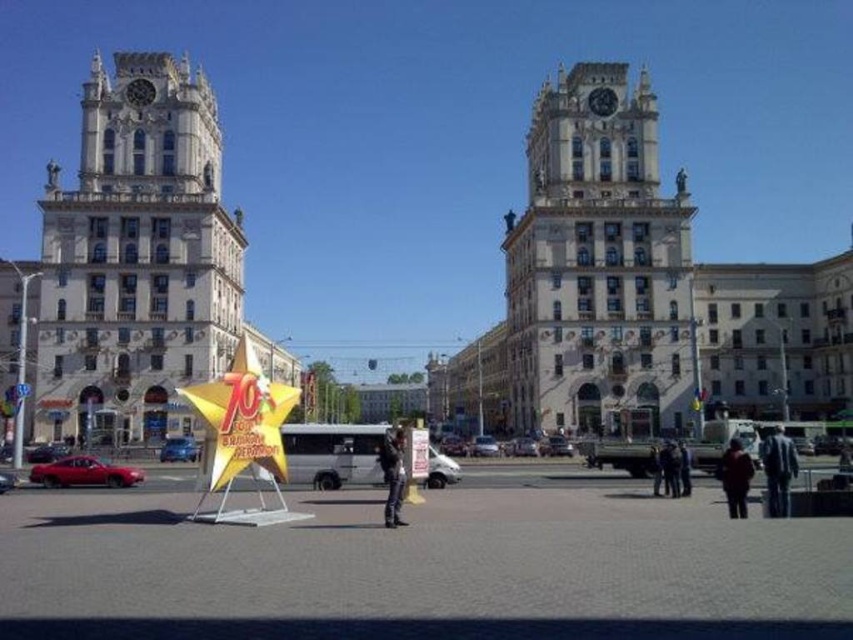
Question: Is white stone clock tower at left positioned before dark brown leather jacket at lower right?

Choices:
 (A) yes
 (B) no

Answer: (B)

Question: Does white stone clock tower at left have a lesser width compared to white stone clock tower at center?

Choices:
 (A) no
 (B) yes

Answer: (B)

Question: Which point appears closest to the camera in this image?

Choices:
 (A) (398, 452)
 (B) (735, 476)
 (C) (590, 294)

Answer: (B)

Question: Is white stone clock tower at center positioned before dark gray suit at lower right?

Choices:
 (A) no
 (B) yes

Answer: (A)

Question: Which point appears closest to the camera in this image?

Choices:
 (A) (566, 419)
 (B) (729, 445)
 (C) (775, 465)

Answer: (C)

Question: Which object is closer to the camera taking this photo?

Choices:
 (A) dark brown leather jacket at lower right
 (B) white stone clock tower at center
 (C) white stone clock tower at left
 (D) dark gray suit at lower right

Answer: (A)